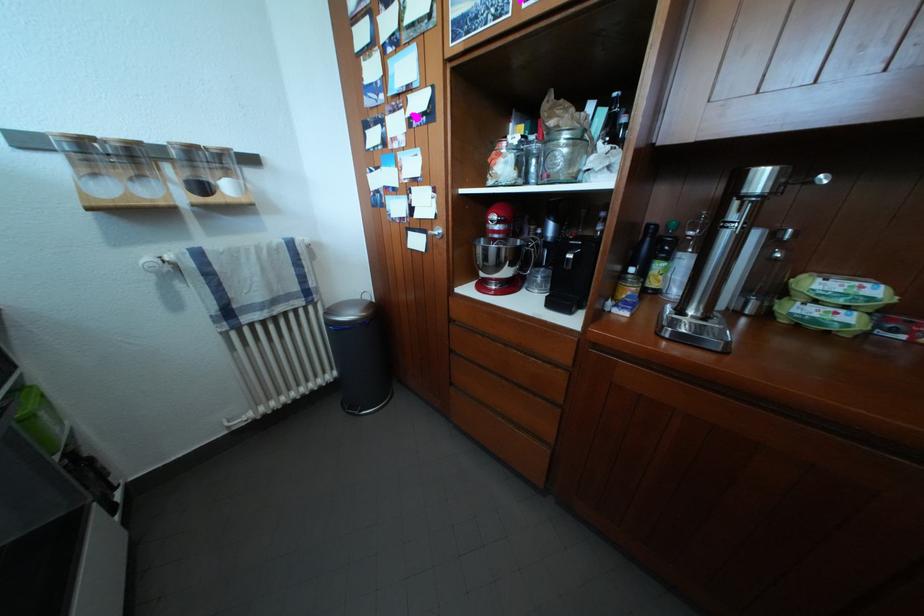
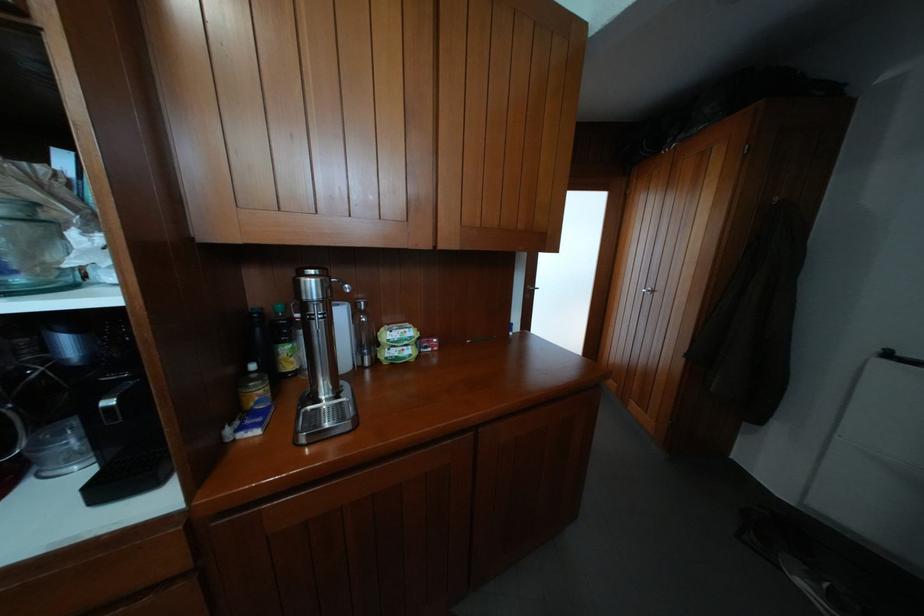
Find the pixel in the second image that matches [865,290] in the first image.

(411, 336)